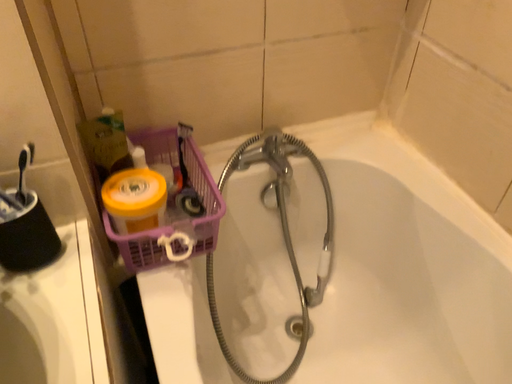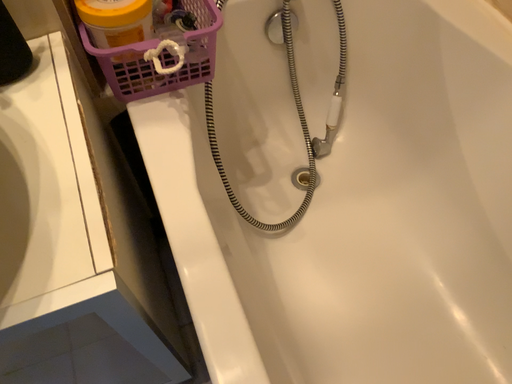
Question: How did the camera likely rotate when shooting the video?

Choices:
 (A) rotated downward
 (B) rotated upward

Answer: (A)